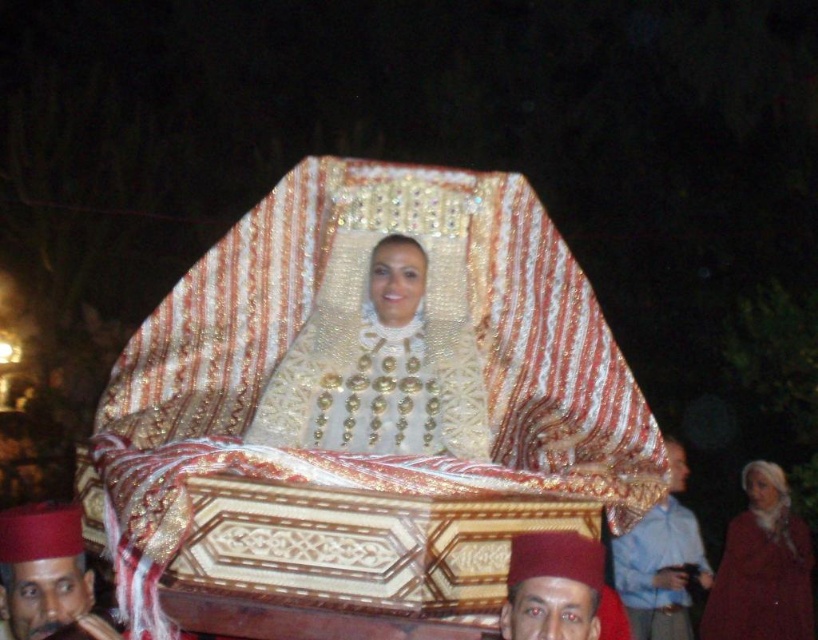
Does matte red hat at lower left have a lesser width compared to matte red fez at lower center?

No.

Locate an element on the screen. This screenshot has height=640, width=818. matte red hat at lower left is located at coordinates (45, 572).

You are a GUI agent. You are given a task and a screenshot of the screen. Output one action in this format:
    pyautogui.click(x=<x>, y=<y>)
    Task: Click on the matte red hat at lower left
    
    Given the screenshot: What is the action you would take?
    pyautogui.click(x=45, y=572)

Does blue cotton shirt at lower right appear over matte red fez at lower center?

Incorrect, blue cotton shirt at lower right is not positioned above matte red fez at lower center.

In the scene shown: Is blue cotton shirt at lower right to the right of matte red fez at lower center from the viewer's perspective?

Yes, blue cotton shirt at lower right is to the right of matte red fez at lower center.

Locate an element on the screen. This screenshot has height=640, width=818. blue cotton shirt at lower right is located at coordinates (661, 561).

Does velvet maroon robe at lower right have a greater height compared to matte red hat at lower left?

Correct, velvet maroon robe at lower right is much taller as matte red hat at lower left.

Is velvet maroon robe at lower right above matte red hat at lower left?

No, velvet maroon robe at lower right is not above matte red hat at lower left.

From the picture: Who is more forward, (798, 561) or (88, 600)?

Point (88, 600) is more forward.

The height and width of the screenshot is (640, 818). Find the location of `velvet maroon robe at lower right`. velvet maroon robe at lower right is located at coordinates (762, 582).